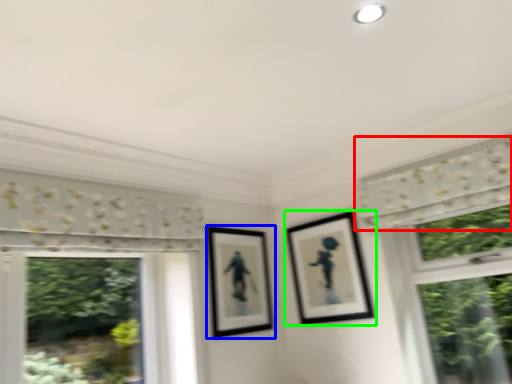
Question: Considering the real-world distances, which object is closest to curtain (highlighted by a red box)? picture frame (highlighted by a blue box) or picture frame (highlighted by a green box).

Choices:
 (A) picture frame
 (B) picture frame

Answer: (B)